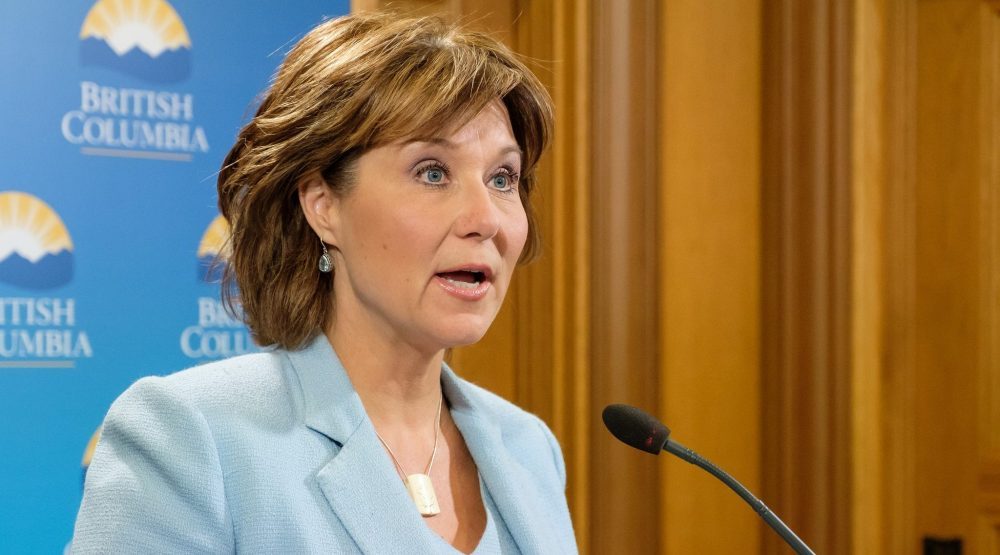
Where is `1 mic`? 1 mic is located at coordinates (633, 432).